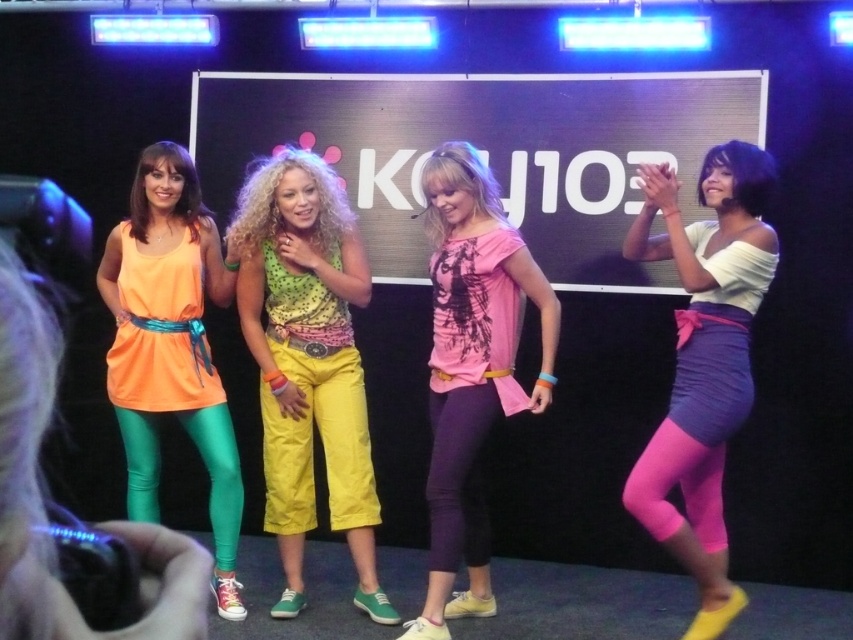
You are a photographer standing at the front of the stage. You want to take a picture of the polka dot fabric top at center. Where should you position your camera to ensure it is centered in the frame?

To center the polka dot fabric top at center in the frame, position your camera directly facing the point at coordinates 0.567 on the x axis and 0.362 on the y axis.

You are an audience member sitting in the front row of the stage. Which of the two performers, the polka dot fabric top at center or the matte orange dress at left, is closer to you?

The polka dot fabric top at center is closer to you because it is further to the viewer than the matte orange dress at left.